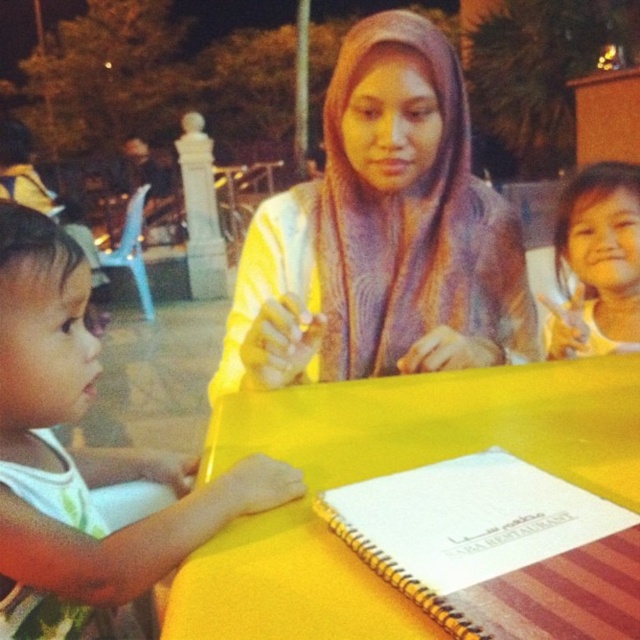
Question: Does white fabric shirt at left appear over purple knitted shawl at center?

Choices:
 (A) yes
 (B) no

Answer: (B)

Question: Considering the real-world distances, which object is closest to the purple knitted shawl at center?

Choices:
 (A) purple knitted scarf at center
 (B) yellow fabric table at center
 (C) white spiral notebook at center

Answer: (A)

Question: Which point is farther from the camera taking this photo?

Choices:
 (A) (544, 576)
 (B) (339, 563)
 (C) (390, 166)

Answer: (C)

Question: Does purple knitted scarf at center have a smaller size compared to purple knitted shawl at center?

Choices:
 (A) yes
 (B) no

Answer: (B)

Question: Does white spiral notebook at center appear on the left side of purple knitted shawl at center?

Choices:
 (A) no
 (B) yes

Answer: (A)

Question: Which object is closer to the camera taking this photo?

Choices:
 (A) purple knitted scarf at center
 (B) yellow fabric table at center

Answer: (B)